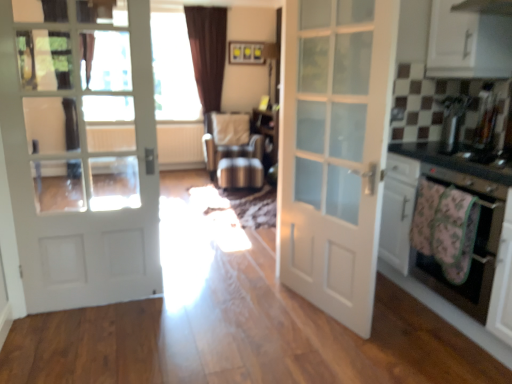
Question: From a real-world perspective, does white glossy cabinet at upper right sit lower than satin silver toaster at upper right?

Choices:
 (A) no
 (B) yes

Answer: (A)

Question: Is white glossy cabinet at upper right positioned before satin silver toaster at upper right?

Choices:
 (A) no
 (B) yes

Answer: (B)

Question: From a real-world perspective, is white glossy cabinet at upper right on satin silver toaster at upper right?

Choices:
 (A) yes
 (B) no

Answer: (A)

Question: Is satin silver toaster at upper right at the back of white glossy cabinet at upper right?

Choices:
 (A) no
 (B) yes

Answer: (A)

Question: Is white glossy cabinet at upper right taller than satin silver toaster at upper right?

Choices:
 (A) no
 (B) yes

Answer: (B)

Question: In terms of height, does white textured radiator at center look taller or shorter compared to black glossy countertop at right?

Choices:
 (A) tall
 (B) short

Answer: (A)

Question: Considering the positions of white textured radiator at center and black glossy countertop at right in the image, is white textured radiator at center wider or thinner than black glossy countertop at right?

Choices:
 (A) wide
 (B) thin

Answer: (B)

Question: Is white textured radiator at center in front of or behind black glossy countertop at right in the image?

Choices:
 (A) front
 (B) behind

Answer: (B)

Question: In the image, is white textured radiator at center on the left side or the right side of black glossy countertop at right?

Choices:
 (A) left
 (B) right

Answer: (A)

Question: From a real-world perspective, is metallic silver chair at center positioned above or below pink fabric oven at right?

Choices:
 (A) below
 (B) above

Answer: (A)

Question: Is metallic silver chair at center inside the boundaries of pink fabric oven at right, or outside?

Choices:
 (A) inside
 (B) outside

Answer: (B)

Question: From the image's perspective, is metallic silver chair at center above or below pink fabric oven at right?

Choices:
 (A) above
 (B) below

Answer: (A)

Question: Is metallic silver chair at center wider or thinner than pink fabric oven at right?

Choices:
 (A) wide
 (B) thin

Answer: (A)

Question: In terms of size, does fluffy floral blanket at lower right appear bigger or smaller than metallic silver chair at center?

Choices:
 (A) small
 (B) big

Answer: (A)

Question: From the image's perspective, is fluffy floral blanket at lower right located above or below metallic silver chair at center?

Choices:
 (A) below
 (B) above

Answer: (A)